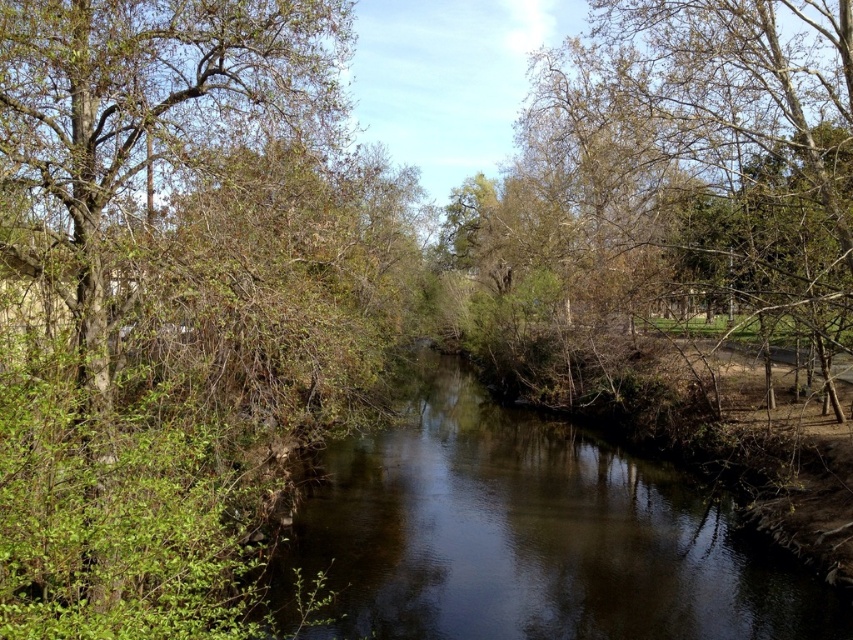
From the picture: Can you confirm if dark brown water at center is shorter than bare branches at center?

Correct, dark brown water at center is not as tall as bare branches at center.

Is point (398, 394) farther from viewer compared to point (848, 54)?

Yes, point (398, 394) is behind point (848, 54).

The width and height of the screenshot is (853, 640). Identify the location of dark brown water at center. (524, 536).

Which is below, green leafy tree at left or bare branches at center?

green leafy tree at left is below.

Is green leafy tree at left smaller than bare branches at center?

Yes, green leafy tree at left is smaller than bare branches at center.

Which is in front, point (120, 177) or point (733, 289)?

Point (120, 177) is more forward.

The width and height of the screenshot is (853, 640). What are the coordinates of `green leafy tree at left` in the screenshot? It's located at (175, 296).

This screenshot has width=853, height=640. I want to click on green leafy tree at left, so click(x=175, y=296).

Describe the element at coordinates (175, 296) in the screenshot. The width and height of the screenshot is (853, 640). I see `green leafy tree at left` at that location.

Which is in front, point (364, 324) or point (380, 449)?

Point (364, 324) is more forward.

Where is `green leafy tree at left`? green leafy tree at left is located at coordinates [x=175, y=296].